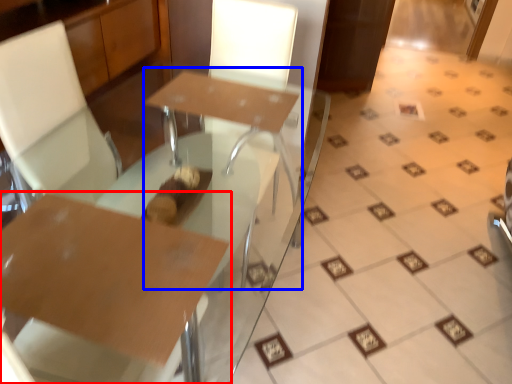
Question: Which of the following is the closest to the observer, table (highlighted by a red box) or round table (highlighted by a blue box)?

Choices:
 (A) table
 (B) round table

Answer: (A)